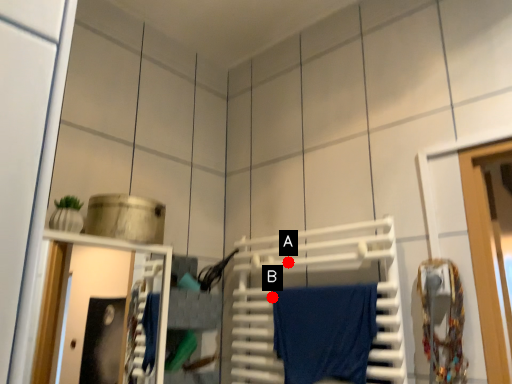
Question: Two points are circled on the image, labeled by A and B beside each circle. Which point is farther from the camera taking this photo?

Choices:
 (A) A is further
 (B) B is further

Answer: (A)